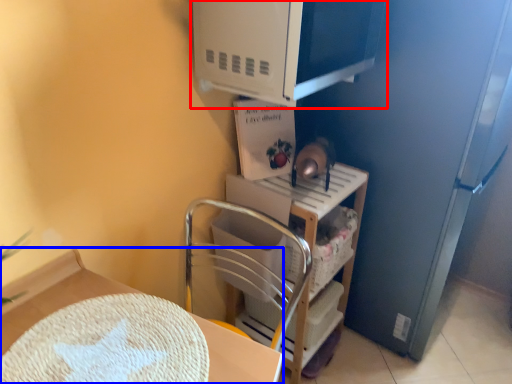
Question: Which of the following is the farthest to the observer, appliance (highlighted by a red box) or furniture (highlighted by a blue box)?

Choices:
 (A) appliance
 (B) furniture

Answer: (A)